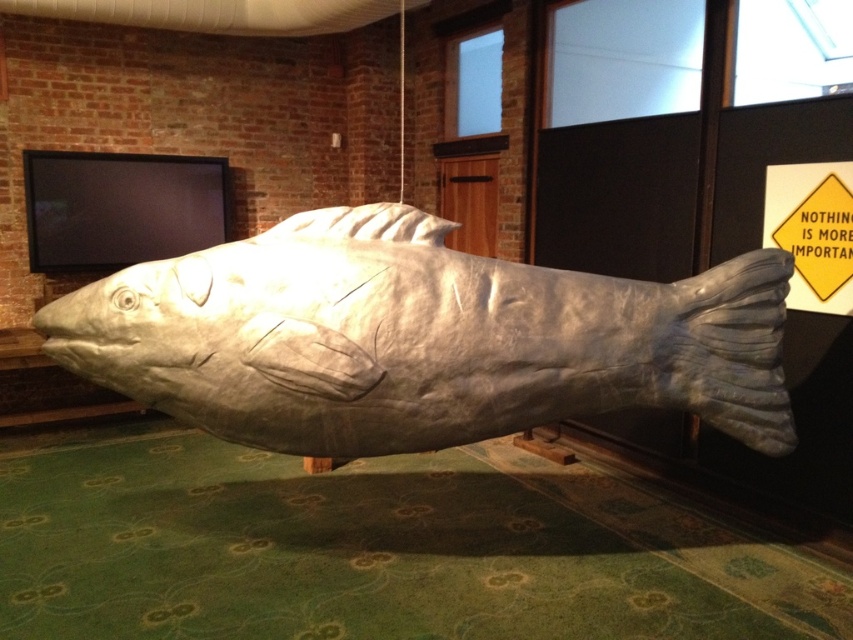
Is metallic fish at center taller than yellow paper sign at upper right?

Yes.

Which is more to the right, metallic fish at center or yellow paper sign at upper right?

yellow paper sign at upper right is more to the right.

At what (x,y) coordinates should I click in order to perform the action: click on metallic fish at center. Please return your answer as a coordinate pair (x, y). This screenshot has height=640, width=853. Looking at the image, I should click on (421, 339).

Find the location of `metallic fish at center`. metallic fish at center is located at coordinates point(421,339).